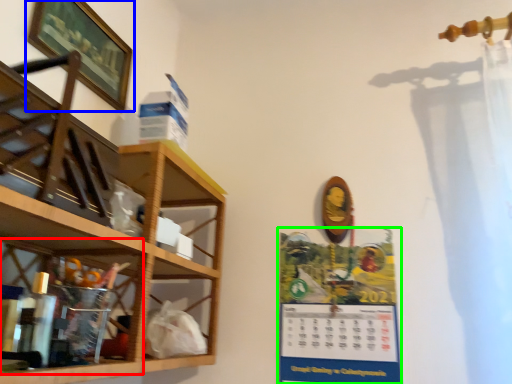
Question: Which object is the farthest from cabinet (highlighted by a red box)? Choose among these: picture frame (highlighted by a blue box) or poster page (highlighted by a green box).

Choices:
 (A) picture frame
 (B) poster page

Answer: (B)